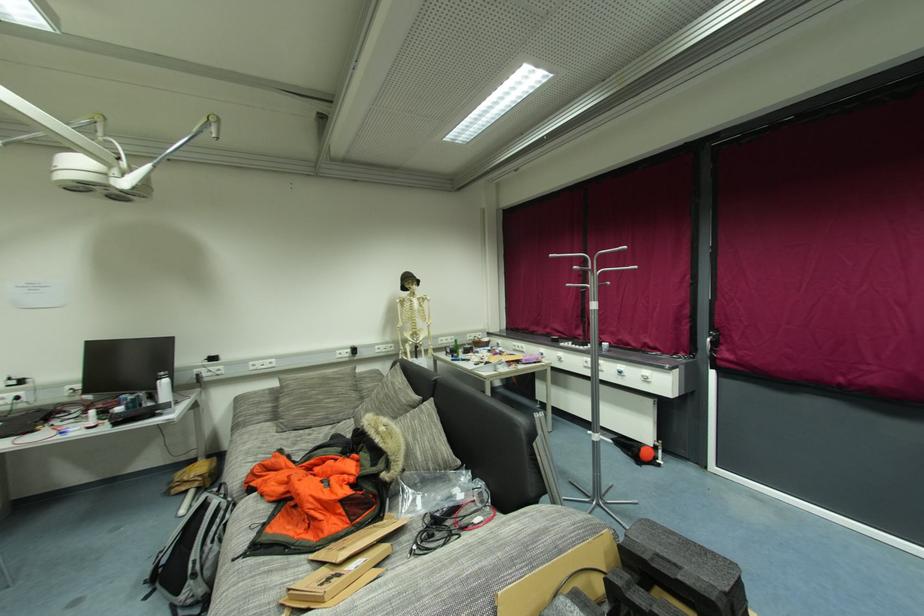
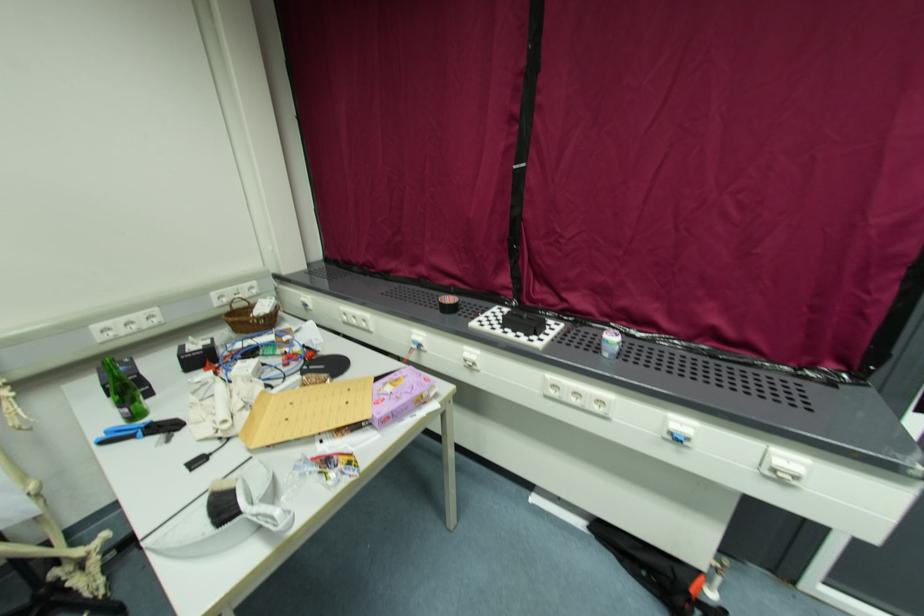
Locate, in the second image, the point that corresponds to point (649, 381) in the first image.

(783, 477)